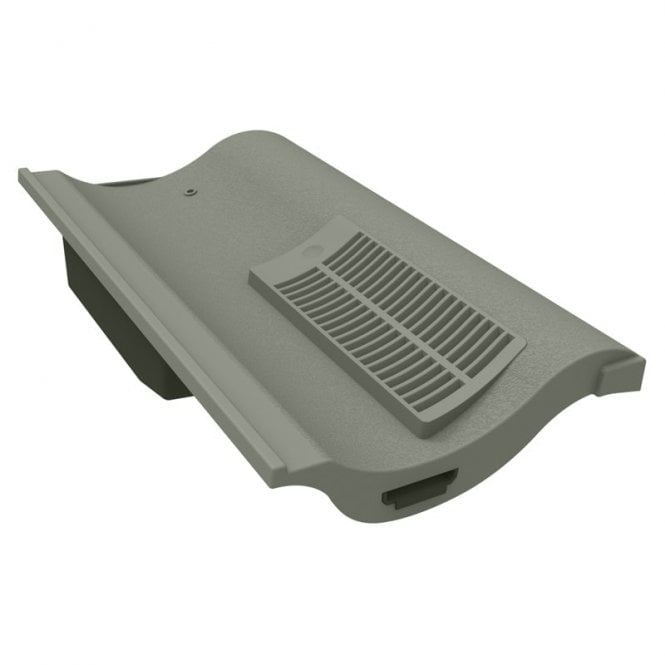
What are the coordinates of `right side of vent` in the screenshot? It's located at (406, 378).